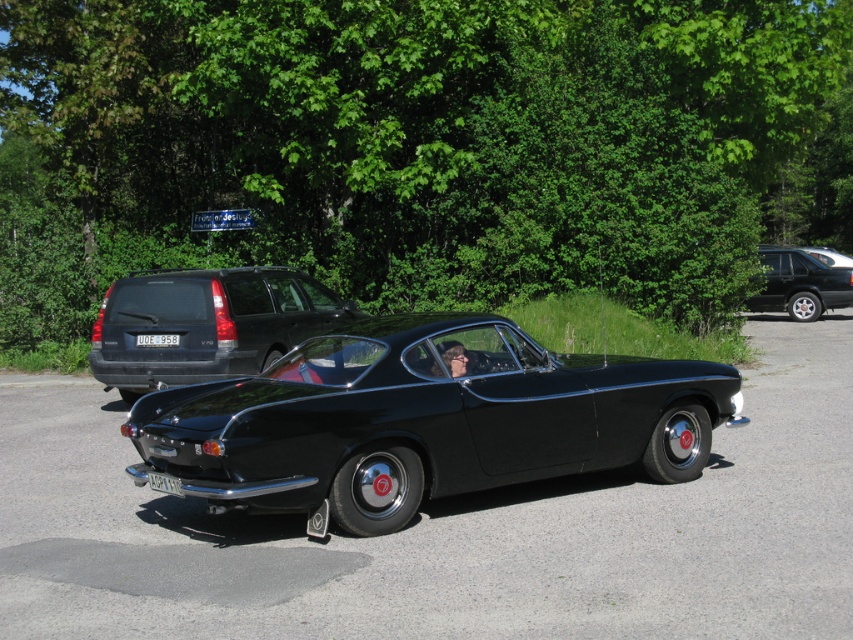
Who is positioned more to the right, blue plastic street sign at upper center or matte black car at center?

matte black car at center

Who is more distant from viewer, (199, 221) or (438, 349)?

The point (199, 221) is behind.

Where is `blue plastic street sign at upper center`? blue plastic street sign at upper center is located at coordinates (222, 220).

In order to click on blue plastic street sign at upper center in this screenshot , I will do `click(222, 220)`.

Is blue plastic street sign at upper center to the right of glossy black car at center from the viewer's perspective?

Incorrect, blue plastic street sign at upper center is not on the right side of glossy black car at center.

Image resolution: width=853 pixels, height=640 pixels. Describe the element at coordinates (222, 220) in the screenshot. I see `blue plastic street sign at upper center` at that location.

This screenshot has width=853, height=640. I want to click on blue plastic street sign at upper center, so click(222, 220).

Looking at this image, is glossy black car at center smaller than white plastic license plate at lower center?

No, glossy black car at center is not smaller than white plastic license plate at lower center.

Can you confirm if glossy black car at center is wider than white plastic license plate at lower center?

Yes, glossy black car at center is wider than white plastic license plate at lower center.

What do you see at coordinates (828, 256) in the screenshot?
I see `glossy black car at center` at bounding box center [828, 256].

Locate an element on the screen. Image resolution: width=853 pixels, height=640 pixels. glossy black car at center is located at coordinates (828, 256).